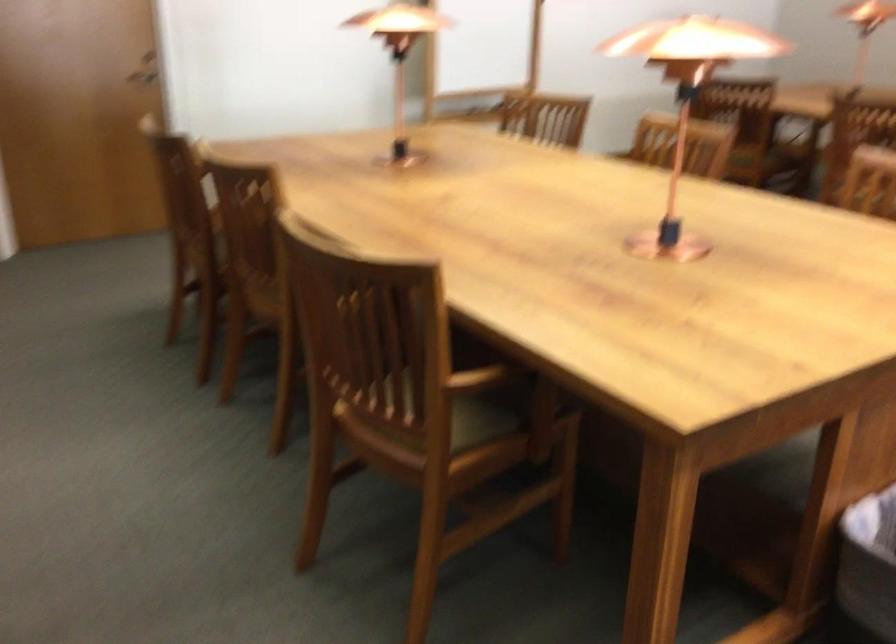
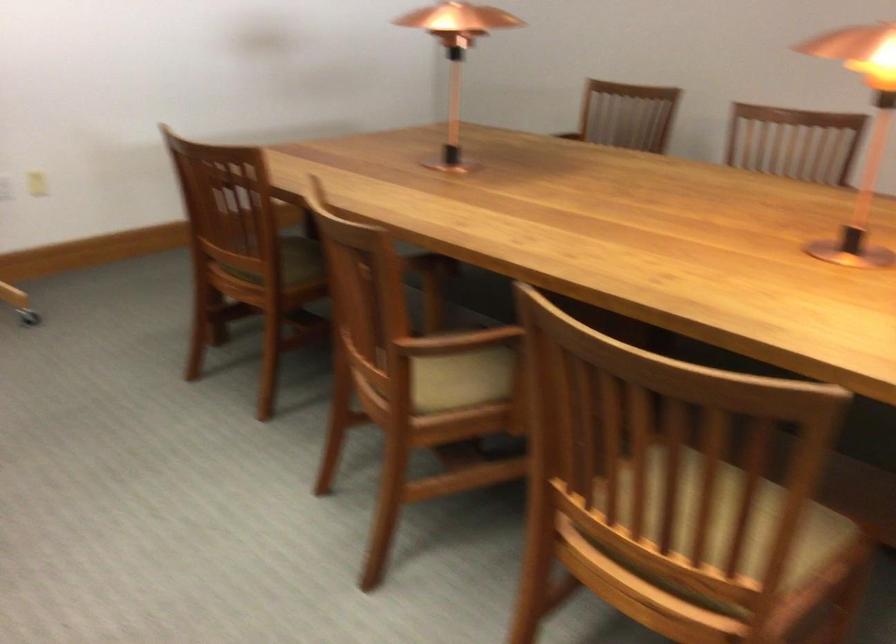
Where in the second image is the point corresponding to the point at 776,125 from the first image?

(289, 263)